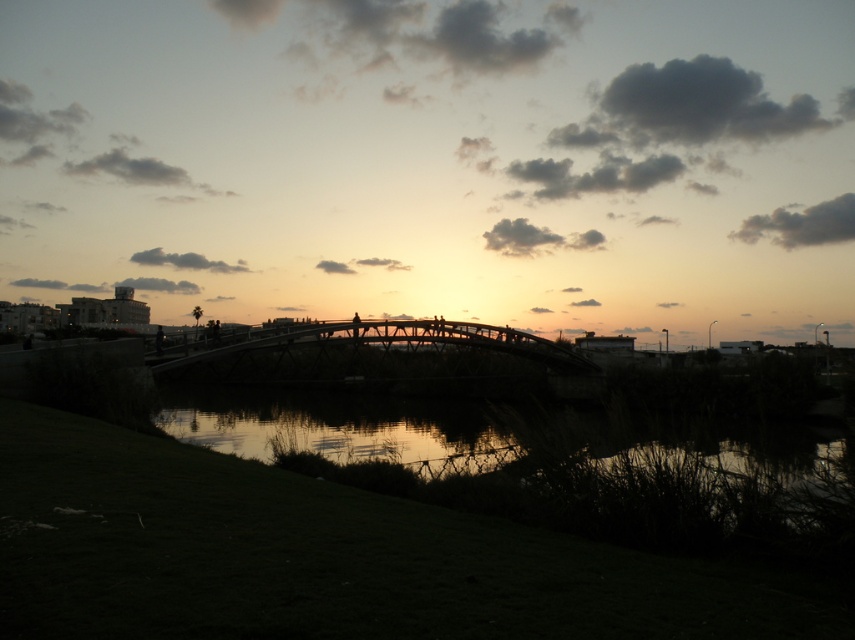
Between silvery reflective water at center and wooden bridge at center, which one appears on the right side from the viewer's perspective?

Positioned to the right is silvery reflective water at center.

This screenshot has height=640, width=855. Describe the element at coordinates (541, 461) in the screenshot. I see `silvery reflective water at center` at that location.

Locate an element on the screen. This screenshot has width=855, height=640. silvery reflective water at center is located at coordinates (541, 461).